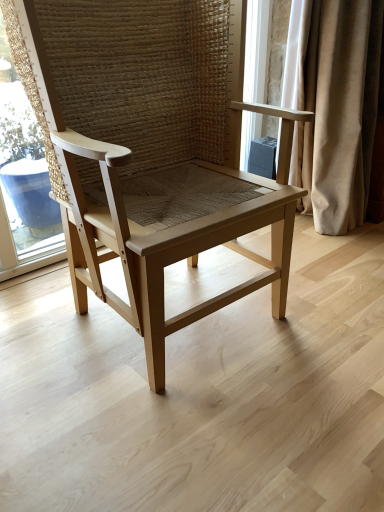
Image resolution: width=384 pixels, height=512 pixels. In order to click on free location to the right of light wood chair at center in this screenshot , I will do `click(324, 314)`.